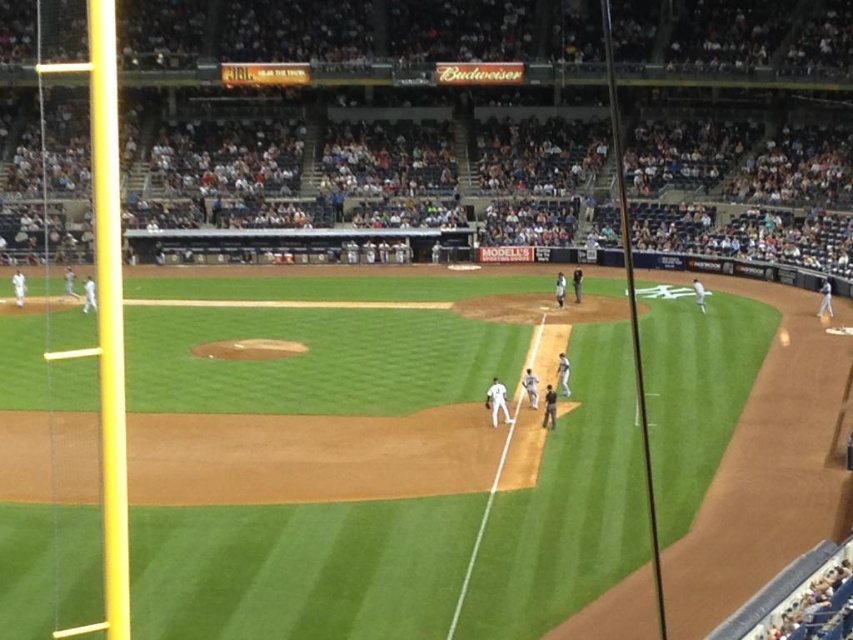
Which is above, dark gray seats at upper center or white matte uniform at center?

dark gray seats at upper center is above.

Does dark gray seats at upper center appear on the right side of white matte uniform at center?

No, dark gray seats at upper center is not to the right of white matte uniform at center.

Locate an element on the screen. This screenshot has height=640, width=853. dark gray seats at upper center is located at coordinates (368, 148).